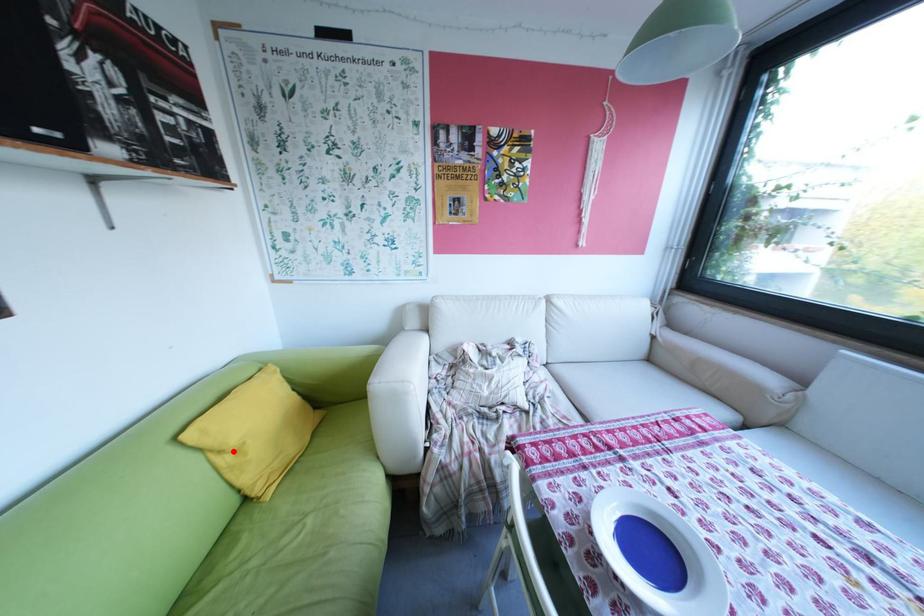
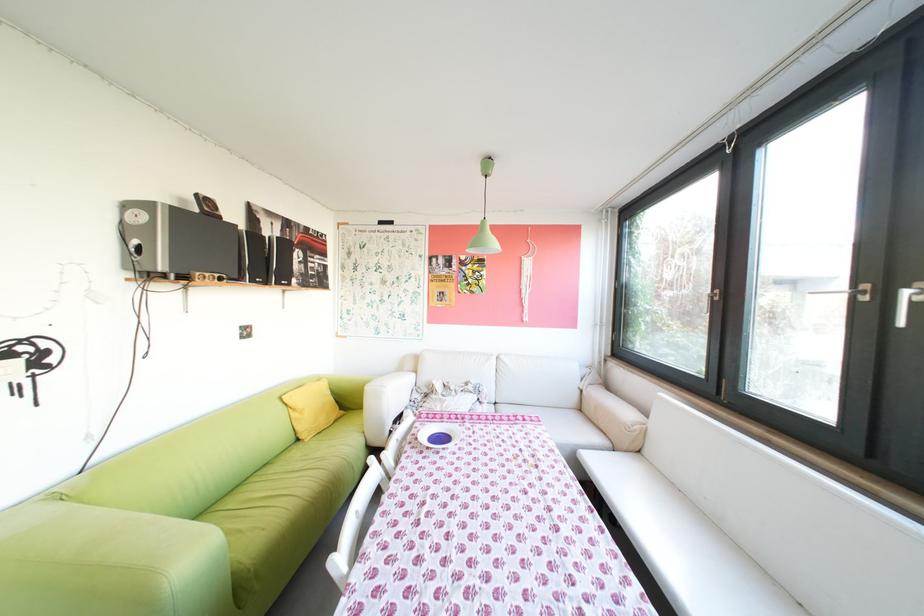
Where in the second image is the point corresponding to the highlighted location from the first image?

(307, 410)